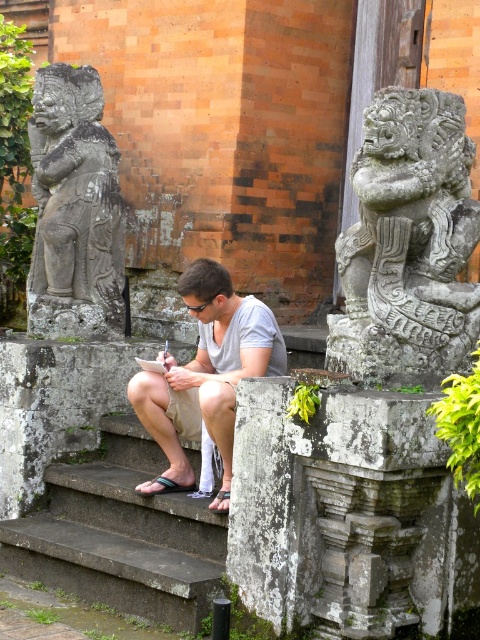
Based on the coordinates provided in the scene description, where is the carved stone lion at upper right located?

The carved stone lion at upper right is located at point (408, 244).

You are standing at the entrance of the temple and want to reach the main hall. The dark gray stone stairs at center are your only path forward. Can you determine their exact location relative to the entrance?

The dark gray stone stairs at center are located at point (120, 536), which is your direct path forward from the entrance.